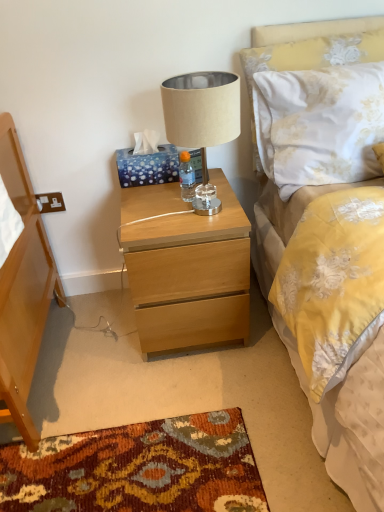
This screenshot has width=384, height=512. Find the location of `beige fabric lampshade at center`. beige fabric lampshade at center is located at coordinates (201, 108).

The width and height of the screenshot is (384, 512). What do you see at coordinates (186, 177) in the screenshot?
I see `clear plastic bottle at center` at bounding box center [186, 177].

Measure the distance between point (195, 179) and camera.

Point (195, 179) and camera are 1.56 meters apart from each other.

Image resolution: width=384 pixels, height=512 pixels. Describe the element at coordinates (307, 54) in the screenshot. I see `white floral fabric pillow at upper right` at that location.

What is the approximate height of light wood nightstand at center?

It is 22.09 inches.

The image size is (384, 512). I want to click on beige fabric lampshade at center, so click(x=201, y=108).

Can you confirm if white floral fabric pillow at upper right is shorter than light wood nightstand at center?

Yes, white floral fabric pillow at upper right is shorter than light wood nightstand at center.

What's the angular difference between white floral fabric pillow at upper right and light wood nightstand at center's facing directions?

There is a 0.836-degree angle between the facing directions of white floral fabric pillow at upper right and light wood nightstand at center.

In the image, is white floral fabric pillow at upper right positioned in front of or behind light wood nightstand at center?

white floral fabric pillow at upper right is behind light wood nightstand at center.

Choose the correct answer: Is light wood nightstand at center inside white floral fabric pillow at upper right or outside it?

light wood nightstand at center is located beyond the bounds of white floral fabric pillow at upper right.

Based on the photo, is light wood nightstand at center wider or thinner than white floral fabric pillow at upper right?

light wood nightstand at center is wider than white floral fabric pillow at upper right.

Find the location of a particular element. The width and height of the screenshot is (384, 512). nightstand beneath the white floral fabric pillow at upper right (from a real-world perspective) is located at coordinates (186, 268).

Where is `lamp in front of the white floral fabric pillow at upper right`? lamp in front of the white floral fabric pillow at upper right is located at coordinates (201, 108).

Is beige fabric lampshade at center completely or partially inside white floral fabric pillow at upper right?

Actually, beige fabric lampshade at center is outside white floral fabric pillow at upper right.

Between white floral fabric pillow at upper right and beige fabric lampshade at center, which one is positioned behind?

white floral fabric pillow at upper right.

Is white floral fabric pillow at upper right not close to beige fabric lampshade at center?

They are positioned close to each other.

From a real-world perspective, which is physically above, beige fabric lampshade at center or light wood nightstand at center?

beige fabric lampshade at center, from a real-world perspective.

Considering the sizes of beige fabric lampshade at center and light wood nightstand at center in the image, is beige fabric lampshade at center taller or shorter than light wood nightstand at center?

Clearly, beige fabric lampshade at center is shorter compared to light wood nightstand at center.

This screenshot has height=512, width=384. I want to click on nightstand that appears behind the beige fabric lampshade at center, so click(186, 268).

Is point (188, 97) farther from camera compared to point (159, 260)?

That is False.

Is clear plastic bottle at center placed right next to beige fabric lampshade at center?

clear plastic bottle at center and beige fabric lampshade at center are not in contact.

Which of these two, clear plastic bottle at center or beige fabric lampshade at center, is wider?

beige fabric lampshade at center is wider.

Looking at this image, considering the relative sizes of clear plastic bottle at center and beige fabric lampshade at center in the image provided, is clear plastic bottle at center bigger than beige fabric lampshade at center?

Incorrect, clear plastic bottle at center is not larger than beige fabric lampshade at center.

Which object is positioned more to the right, clear plastic bottle at center or beige fabric lampshade at center?

Positioned to the right is beige fabric lampshade at center.

Considering the positions of points (380, 33) and (188, 176), is point (380, 33) closer to camera compared to point (188, 176)?

Yes, point (380, 33) is closer to viewer.

Would you consider white floral fabric pillow at upper right to be distant from clear plastic bottle at center?

white floral fabric pillow at upper right is near clear plastic bottle at center, not far away.

Considering the relative sizes of white floral fabric pillow at upper right and clear plastic bottle at center in the image provided, is white floral fabric pillow at upper right shorter than clear plastic bottle at center?

Incorrect, the height of white floral fabric pillow at upper right does not fall short of that of clear plastic bottle at center.

From the image's perspective, is white floral fabric pillow at upper right located above clear plastic bottle at center?

Correct, white floral fabric pillow at upper right appears higher than clear plastic bottle at center in the image.

Is clear plastic bottle at center not inside light wood nightstand at center?

clear plastic bottle at center is positioned outside light wood nightstand at center.

Could you tell me if clear plastic bottle at center is turned towards light wood nightstand at center?

No.

Can you tell me how much clear plastic bottle at center and light wood nightstand at center differ in facing direction?

clear plastic bottle at center and light wood nightstand at center are facing 0.0011 degrees away from each other.

Considering the sizes of objects clear plastic bottle at center and light wood nightstand at center in the image provided, who is bigger, clear plastic bottle at center or light wood nightstand at center?

light wood nightstand at center is bigger.

The height and width of the screenshot is (512, 384). What are the coordinates of `pillow above the light wood nightstand at center (from the image's perspective)` in the screenshot? It's located at (307, 54).

The height and width of the screenshot is (512, 384). Find the location of `pillow on the right of light wood nightstand at center`. pillow on the right of light wood nightstand at center is located at coordinates (307, 54).

From the picture: Looking at the image, which one is located closer to white floral fabric pillow at upper right, beige fabric lampshade at center or clear plastic bottle at center?

beige fabric lampshade at center is closer to white floral fabric pillow at upper right.

Estimate the real-world distances between objects in this image. Which object is further from clear plastic bottle at center, light wood nightstand at center or white floral fabric pillow at upper right?

white floral fabric pillow at upper right.

From the image, which object appears to be farther from beige fabric lampshade at center, white floral fabric pillow at upper right or clear plastic bottle at center?

clear plastic bottle at center lies further to beige fabric lampshade at center than the other object.

Consider the image. Which object lies further to the anchor point white floral fabric pillow at upper right, light wood nightstand at center or clear plastic bottle at center?

Based on the image, light wood nightstand at center appears to be further to white floral fabric pillow at upper right.

Estimate the real-world distances between objects in this image. Which object is further from beige fabric lampshade at center, clear plastic bottle at center or light wood nightstand at center?

light wood nightstand at center lies further to beige fabric lampshade at center than the other object.

Looking at the image, which one is located closer to light wood nightstand at center, beige fabric lampshade at center or white floral fabric pillow at upper right?

Based on the image, beige fabric lampshade at center appears to be nearer to light wood nightstand at center.

Which object lies nearer to the anchor point beige fabric lampshade at center, light wood nightstand at center or white floral fabric pillow at upper right?

Based on the image, white floral fabric pillow at upper right appears to be nearer to beige fabric lampshade at center.

When comparing their distances from light wood nightstand at center, does beige fabric lampshade at center or clear plastic bottle at center seem further?

beige fabric lampshade at center is further to light wood nightstand at center.

Locate an element on the screen. lamp between white floral fabric pillow at upper right and light wood nightstand at center in the vertical direction is located at coordinates (201, 108).

Locate an element on the screen. The width and height of the screenshot is (384, 512). lamp between clear plastic bottle at center and white floral fabric pillow at upper right is located at coordinates (201, 108).

The height and width of the screenshot is (512, 384). I want to click on bottle that lies between white floral fabric pillow at upper right and light wood nightstand at center from top to bottom, so click(186, 177).

Where is `bottle between beige fabric lampshade at center and light wood nightstand at center vertically`? bottle between beige fabric lampshade at center and light wood nightstand at center vertically is located at coordinates (186, 177).